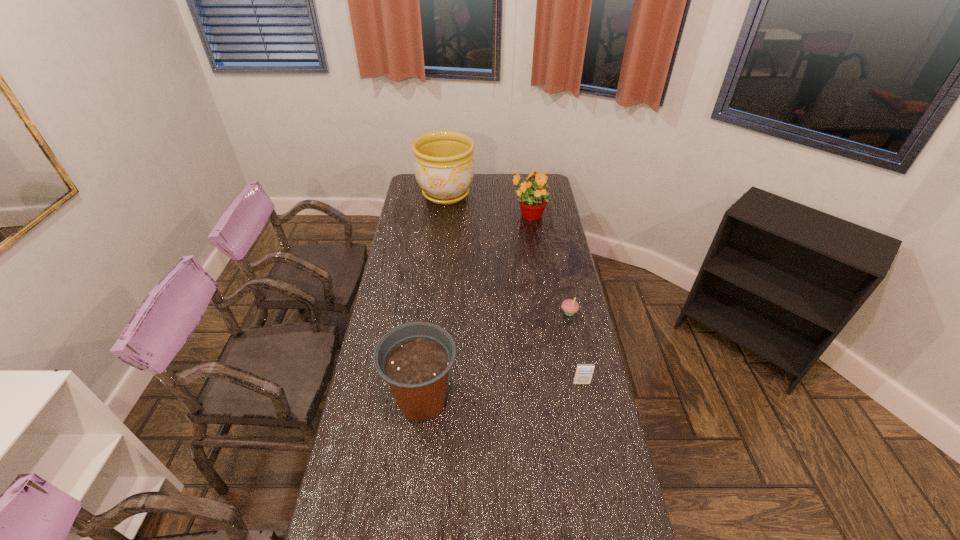
At what (x,y) coordinates should I click in order to perform the action: click on the rightmost flowerpot. Please return your answer as a coordinate pair (x, y). This screenshot has width=960, height=540. Looking at the image, I should click on (532, 200).

Image resolution: width=960 pixels, height=540 pixels. Find the location of `the nearest flowerpot`. the nearest flowerpot is located at coordinates (415, 358).

Find the location of a particular element. Image resolution: width=960 pixels, height=540 pixels. iPod is located at coordinates (583, 374).

Image resolution: width=960 pixels, height=540 pixels. Identify the location of the third nearest object. (569, 306).

Where is `free space located on the back of the rightmost flowerpot`? free space located on the back of the rightmost flowerpot is located at coordinates (524, 184).

I want to click on vacant space situated 0.050m on the back of the nearest flowerpot, so click(x=427, y=358).

Where is `vacant space located 0.100m on the front-facing side of the iPod`? vacant space located 0.100m on the front-facing side of the iPod is located at coordinates (588, 411).

Find the location of a particular element. Image resolution: width=960 pixels, height=540 pixels. free location located 0.130m on the back of the third farthest object is located at coordinates (564, 284).

Where is `object at the far edge`? This screenshot has height=540, width=960. object at the far edge is located at coordinates (444, 168).

You are a GUI agent. You are given a task and a screenshot of the screen. Output one action in this format:
    pyautogui.click(x=<x>, y=<y>)
    Task: Click on the flowerpot present at the right edge
    
    Given the screenshot: What is the action you would take?
    pyautogui.click(x=532, y=200)